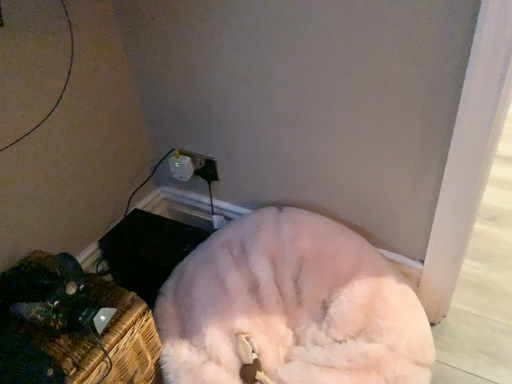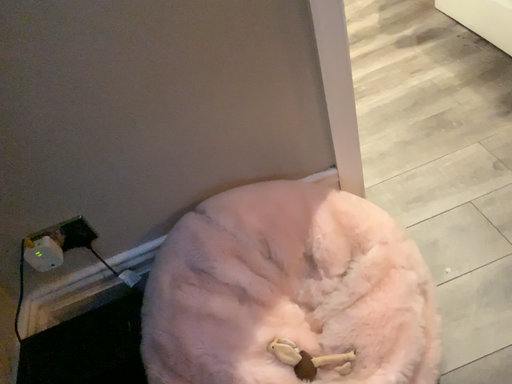
Question: Which way did the camera rotate in the video?

Choices:
 (A) rotated right
 (B) rotated left

Answer: (A)